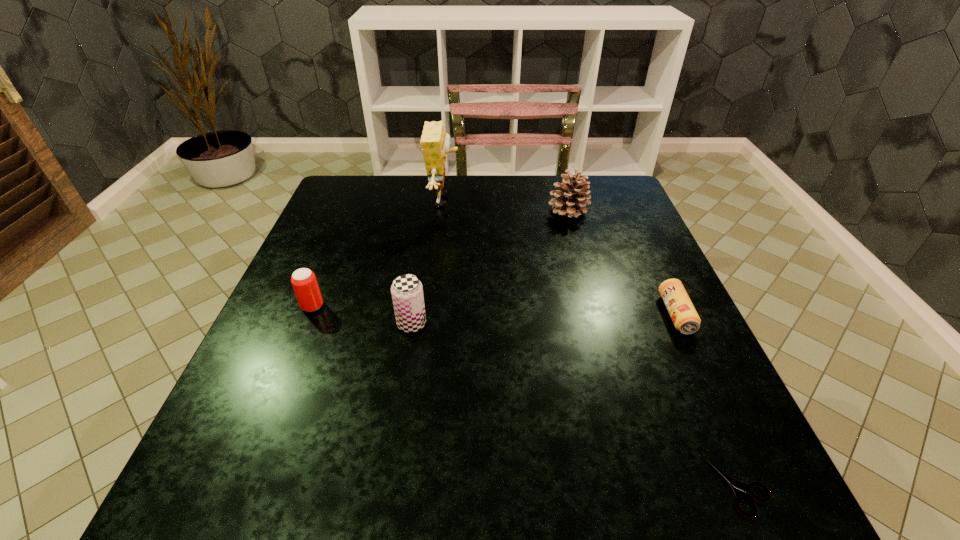
What are the coordinates of `the tallest object` in the screenshot? It's located at (435, 143).

Locate an element on the screen. the third object from right to left is located at coordinates (571, 200).

Locate an element on the screen. the tallest beer can is located at coordinates (407, 292).

Identify the location of the second shortest beer can. This screenshot has width=960, height=540. (304, 282).

At what (x,y) coordinates should I click in order to perform the action: click on the leftmost beer can. Please return your answer as a coordinate pair (x, y). Looking at the image, I should click on (304, 282).

The image size is (960, 540). I want to click on the shortest beer can, so click(686, 320).

Identify the location of the fifth tallest object. (686, 320).

I want to click on the shortest object, so click(739, 488).

What are the coordinates of `shears` in the screenshot? It's located at (739, 488).

Identify the location of vacant point located on the face of the sponge. (581, 200).